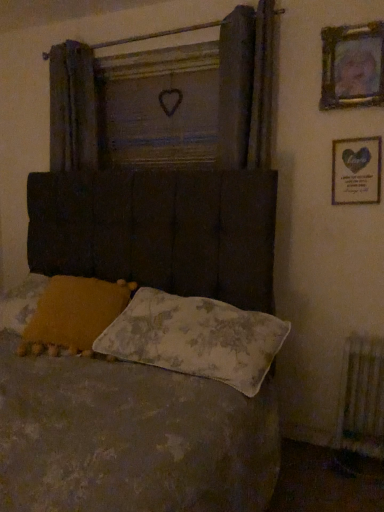
Question: Is white textured radiator at lower right completely or partially outside of fluffy yellow pillow at lower left, placed as the 1th pillow when sorted from left to right?

Choices:
 (A) yes
 (B) no

Answer: (A)

Question: From a real-world perspective, is white textured radiator at lower right physically above fluffy yellow pillow at lower left, positioned as the 2th pillow in right-to-left order?

Choices:
 (A) yes
 (B) no

Answer: (B)

Question: Is white textured radiator at lower right at the left side of fluffy yellow pillow at lower left, placed as the 1th pillow when sorted from left to right?

Choices:
 (A) yes
 (B) no

Answer: (B)

Question: Is white textured radiator at lower right positioned before fluffy yellow pillow at lower left, placed as the 1th pillow when sorted from left to right?

Choices:
 (A) no
 (B) yes

Answer: (A)

Question: Is fluffy yellow pillow at lower left, placed as the 1th pillow when sorted from left to right, a part of white textured radiator at lower right?

Choices:
 (A) yes
 (B) no

Answer: (B)

Question: From the image's perspective, is textured fabric bed at center located above or below wooden heart at center?

Choices:
 (A) below
 (B) above

Answer: (A)

Question: In terms of width, does textured fabric bed at center look wider or thinner when compared to wooden heart at center?

Choices:
 (A) thin
 (B) wide

Answer: (B)

Question: Considering the positions of textured fabric bed at center and wooden heart at center in the image, is textured fabric bed at center bigger or smaller than wooden heart at center?

Choices:
 (A) big
 (B) small

Answer: (A)

Question: Based on their positions, is textured fabric bed at center located to the left or right of wooden heart at center?

Choices:
 (A) right
 (B) left

Answer: (B)

Question: Is white textured radiator at lower right to the left or to the right of textured fabric bed at center in the image?

Choices:
 (A) left
 (B) right

Answer: (B)

Question: Based on their sizes in the image, would you say white textured radiator at lower right is bigger or smaller than textured fabric bed at center?

Choices:
 (A) big
 (B) small

Answer: (B)

Question: In terms of width, does white textured radiator at lower right look wider or thinner when compared to textured fabric bed at center?

Choices:
 (A) thin
 (B) wide

Answer: (A)

Question: Considering the positions of white textured radiator at lower right and textured fabric bed at center in the image, is white textured radiator at lower right taller or shorter than textured fabric bed at center?

Choices:
 (A) short
 (B) tall

Answer: (A)

Question: Considering the relative positions of gold-framed picture at upper right, the first picture frame positioned from the top, and dark gray fabric curtain at upper left in the image provided, is gold-framed picture at upper right, the first picture frame positioned from the top, to the left or to the right of dark gray fabric curtain at upper left?

Choices:
 (A) right
 (B) left

Answer: (A)

Question: Looking at the image, does gold-framed picture at upper right, the second picture frame in the bottom-to-top sequence, seem bigger or smaller compared to dark gray fabric curtain at upper left?

Choices:
 (A) small
 (B) big

Answer: (A)